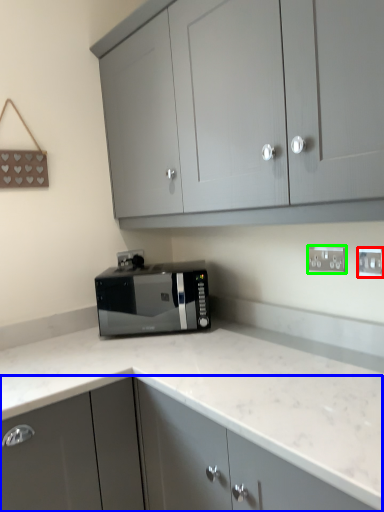
Question: Which object is the farthest from electric outlet (highlighted by a red box)? Choose among these: cabinetry (highlighted by a blue box) or electric outlet (highlighted by a green box).

Choices:
 (A) cabinetry
 (B) electric outlet

Answer: (A)